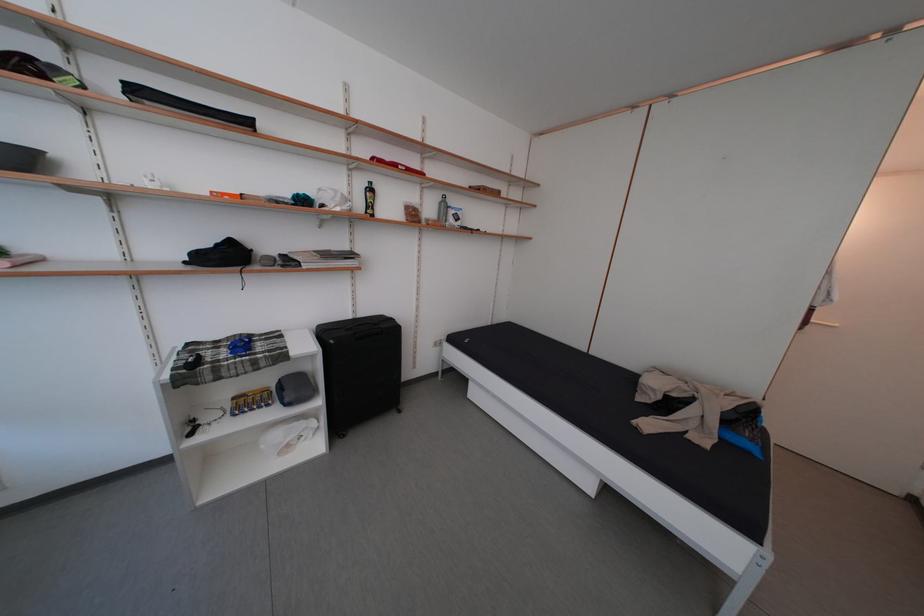
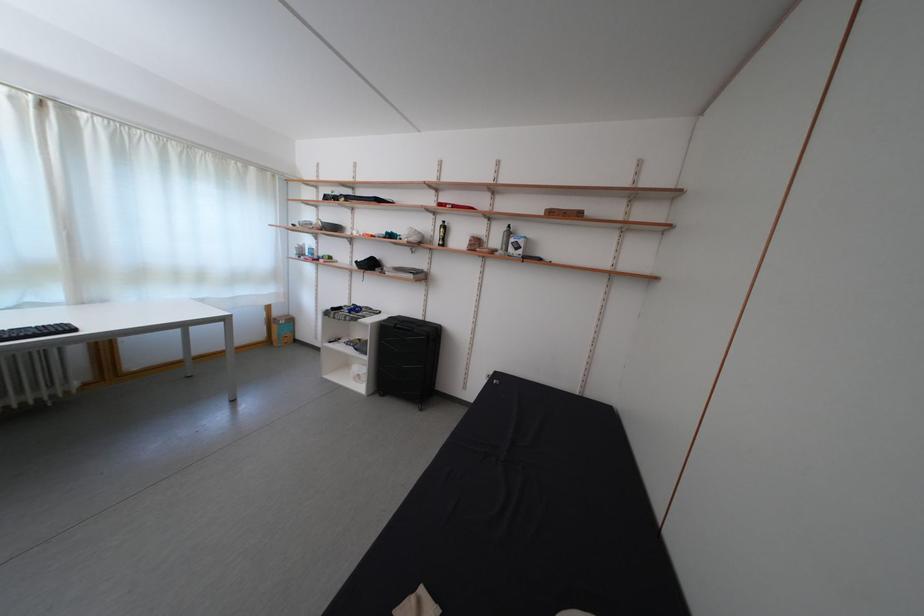
Find the pixel in the second image that matches the point at 439,216 in the first image.

(505, 246)